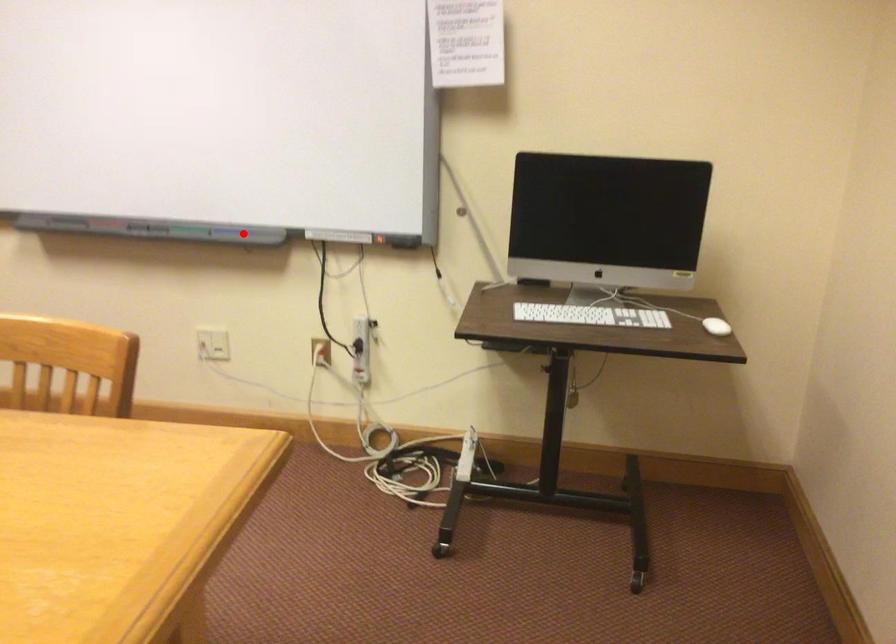
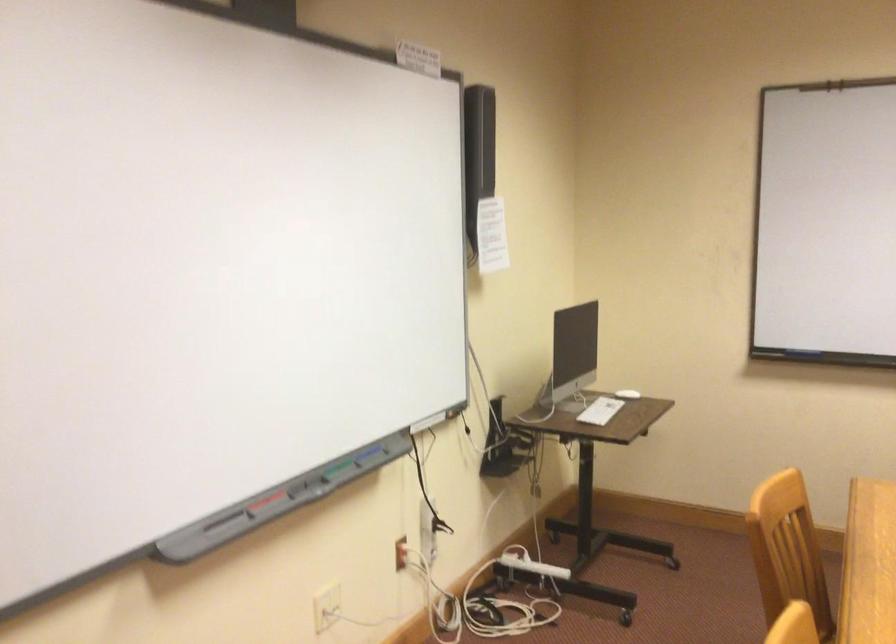
Question: A red point is marked in image1. In image2, is the corresponding 3D point closer to the camera or farther? Reply with the corresponding letter.

Choices:
 (A) The corresponding 3D point is closer.
 (B) The corresponding 3D point is farther.

Answer: (A)